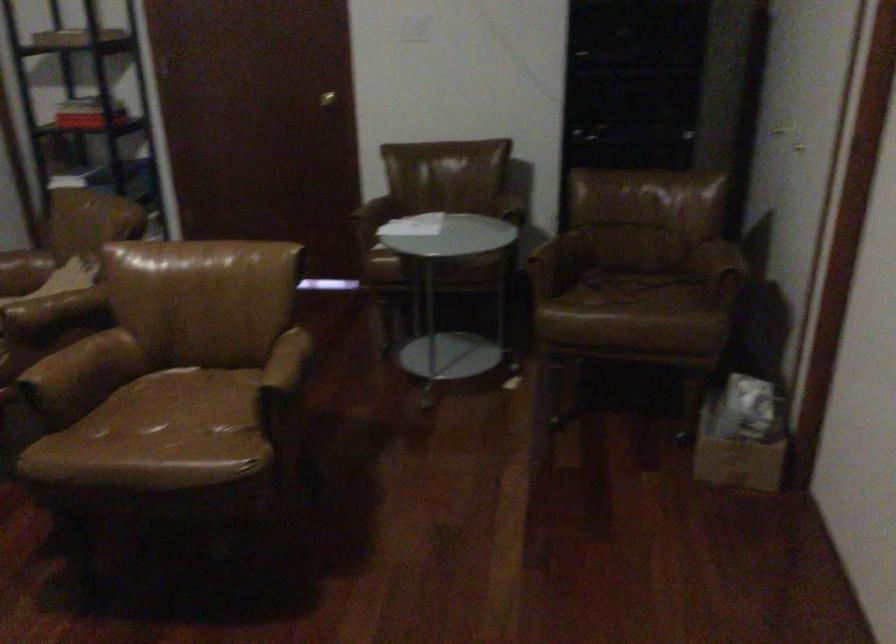
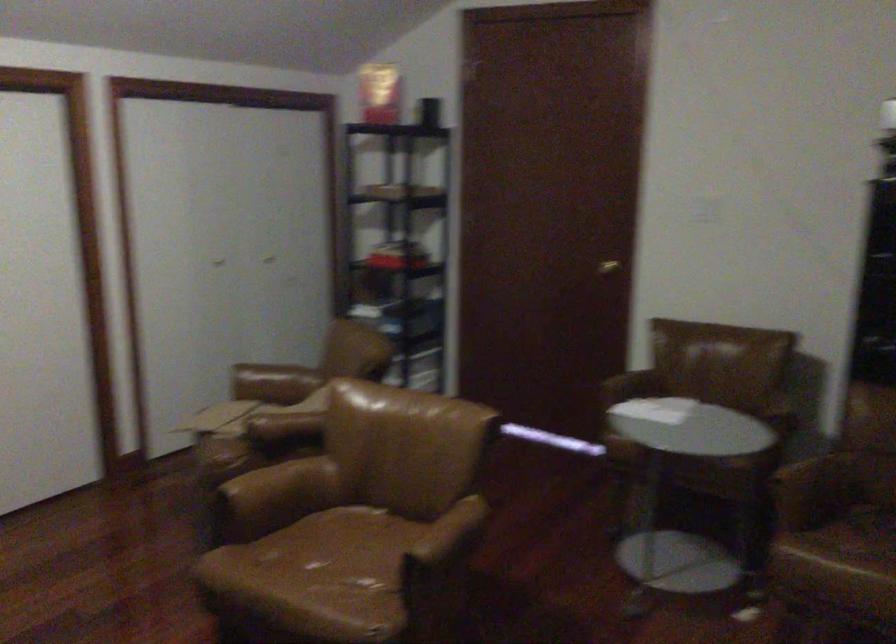
Locate, in the second image, the point that corresponds to point (289, 363) in the first image.

(448, 536)